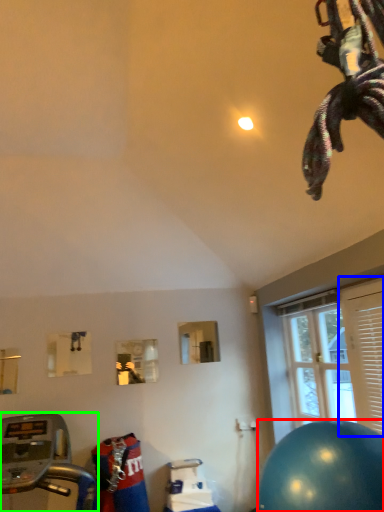
Question: Which is nearer to the ball (highlighted by a red box)? shutter (highlighted by a blue box) or treadmill (highlighted by a green box).

Choices:
 (A) shutter
 (B) treadmill

Answer: (A)